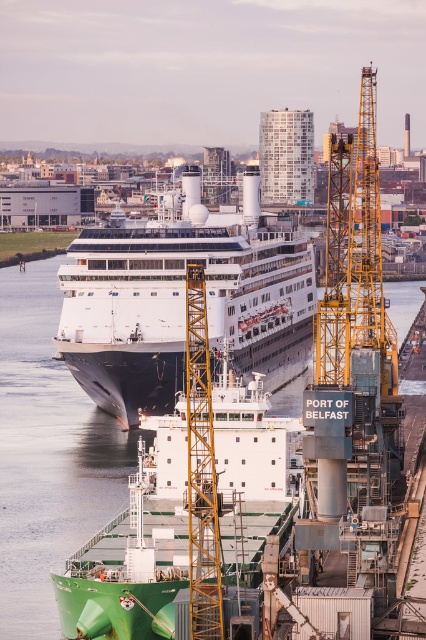
Between point (184, 232) and point (316, 342), which one is positioned behind?

The point (184, 232) is behind.

Image resolution: width=426 pixels, height=640 pixels. Describe the element at coordinates (181, 301) in the screenshot. I see `white glossy cruise ship at center` at that location.

Where is `white glossy cruise ship at center`? The height and width of the screenshot is (640, 426). white glossy cruise ship at center is located at coordinates (181, 301).

Is clear water at center smaller than yellow metallic crane at right?

Actually, clear water at center might be larger than yellow metallic crane at right.

Which is below, clear water at center or yellow metallic crane at right?

clear water at center is below.

This screenshot has width=426, height=640. Find the location of `clear water at center`. clear water at center is located at coordinates (48, 454).

Locate an element on the screen. clear water at center is located at coordinates (48, 454).

Is white glossy cruise ship at center to the right of clear water at center from the viewer's perspective?

Correct, you'll find white glossy cruise ship at center to the right of clear water at center.

Which is more to the right, white glossy cruise ship at center or clear water at center?

white glossy cruise ship at center

Between point (270, 317) and point (54, 509), which one is positioned behind?

Positioned behind is point (270, 317).

Where is `white glossy cruise ship at center`? Image resolution: width=426 pixels, height=640 pixels. white glossy cruise ship at center is located at coordinates (181, 301).